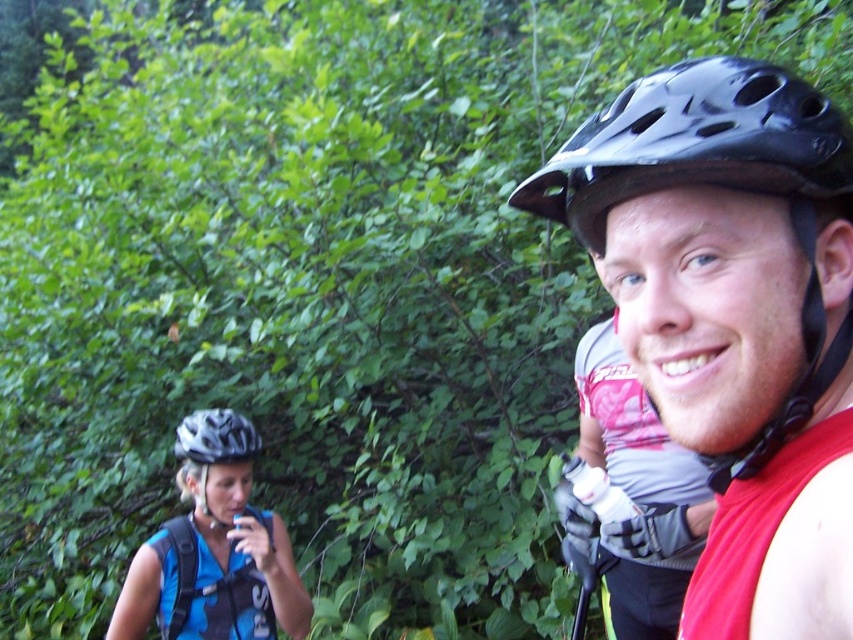
You are a photographer trying to capture both the black matte helmet at center and the matte black helmet at left in a single shot. Based on their positions, which helmet will appear larger in the photo?

The black matte helmet at center will appear larger in the photo because it is closer to the camera than the matte black helmet at left.

You are planning to place a small flag between the black matte helmet at center and the white matte bicycle helmet at left. According to the scene, which helmet should the flag be closer to?

The black matte helmet at center is located above the white matte bicycle helmet at left, so the flag should be placed closer to the white matte bicycle helmet at left since it is lower in position.